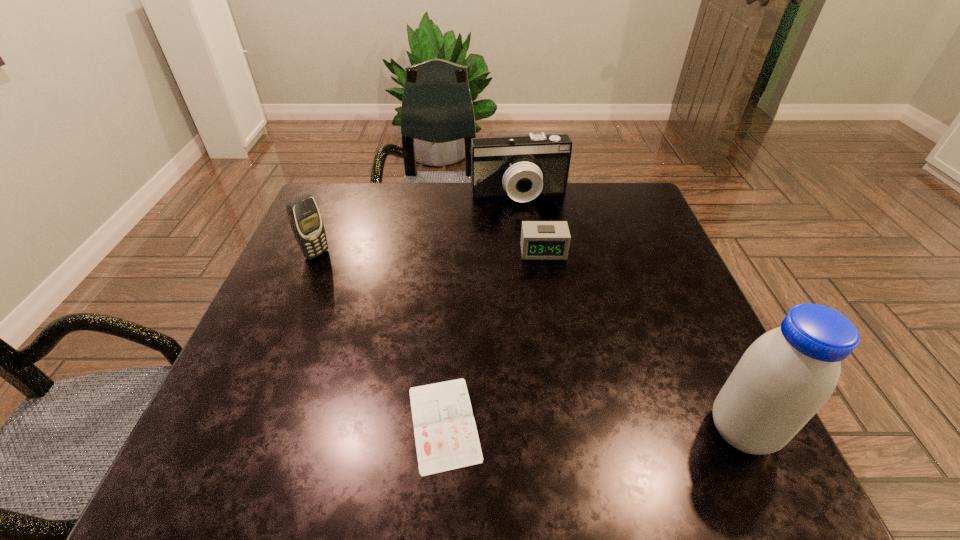
Locate an element on the screen. The image size is (960, 540). free spot between the leftmost object and the alarm clock is located at coordinates (430, 253).

The height and width of the screenshot is (540, 960). I want to click on vacant area that lies between the tallest object and the alarm clock, so click(642, 341).

What are the coordinates of `empty space that is in between the alarm clock and the diary` in the screenshot? It's located at pos(493,337).

What are the coordinates of `free space between the shortest object and the alarm clock` in the screenshot? It's located at (493, 337).

You are a GUI agent. You are given a task and a screenshot of the screen. Output one action in this format:
    pyautogui.click(x=<x>, y=<y>)
    Task: Click on the blank region between the cellular telephone and the tallest object
    The image size is (960, 540).
    Given the screenshot: What is the action you would take?
    pyautogui.click(x=529, y=342)

This screenshot has height=540, width=960. I want to click on free spot between the farthest object and the leftmost object, so click(x=418, y=225).

Locate an element on the screen. free spot between the rightmost object and the farthest object is located at coordinates (630, 313).

I want to click on the closest object to the tallest object, so click(446, 437).

You are a GUI agent. You are given a task and a screenshot of the screen. Output one action in this format:
    pyautogui.click(x=<x>, y=<y>)
    Task: Click on the object that is the closest to the farthest object
    
    Given the screenshot: What is the action you would take?
    pos(540,240)

Identify the location of free space that satisfies the following two spatial constraints: 1. on the front side of the farthest object; 2. on the left side of the soya milk. Image resolution: width=960 pixels, height=540 pixels. (546, 430).